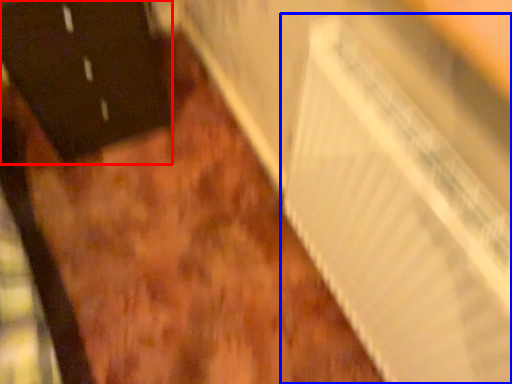
Question: Which point is further to the camera, door (highlighted by a red box) or radiator (highlighted by a blue box)?

Choices:
 (A) door
 (B) radiator

Answer: (A)